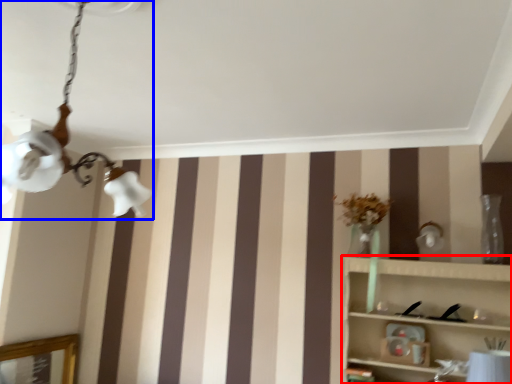
Question: Which object appears farthest to the camera in this image, shelf (highlighted by a red box) or lamp (highlighted by a blue box)?

Choices:
 (A) shelf
 (B) lamp

Answer: (A)